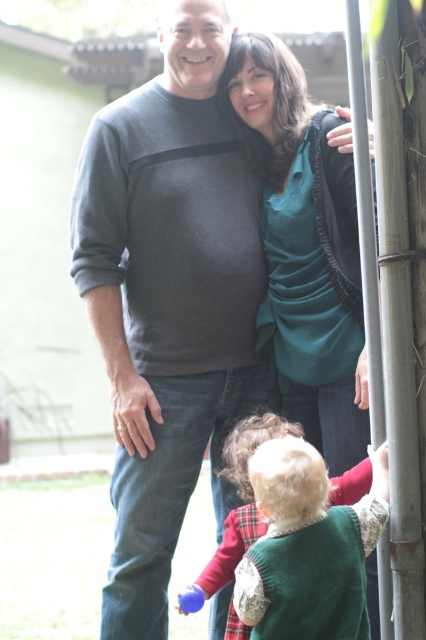
Question: Which object is closer to the camera taking this photo?

Choices:
 (A) green fuzzy vest at lower center
 (B) rubber blue ball at lower center
 (C) teal satin blouse at center

Answer: (A)

Question: Which object is closer to the camera taking this photo?

Choices:
 (A) teal satin blouse at center
 (B) green fuzzy vest at lower center
 (C) gray cotton sweater at center

Answer: (B)

Question: Does teal satin blouse at center appear on the right side of rubber blue ball at lower center?

Choices:
 (A) yes
 (B) no

Answer: (A)

Question: Does gray cotton sweater at center have a larger size compared to rubber blue ball at lower center?

Choices:
 (A) no
 (B) yes

Answer: (B)

Question: Among these objects, which one is farthest from the camera?

Choices:
 (A) gray cotton sweater at center
 (B) green fuzzy vest at lower center
 (C) teal satin blouse at center
 (D) rubber blue ball at lower center

Answer: (A)

Question: Considering the relative positions of teal satin blouse at center and rubber blue ball at lower center in the image provided, where is teal satin blouse at center located with respect to rubber blue ball at lower center?

Choices:
 (A) below
 (B) above

Answer: (B)